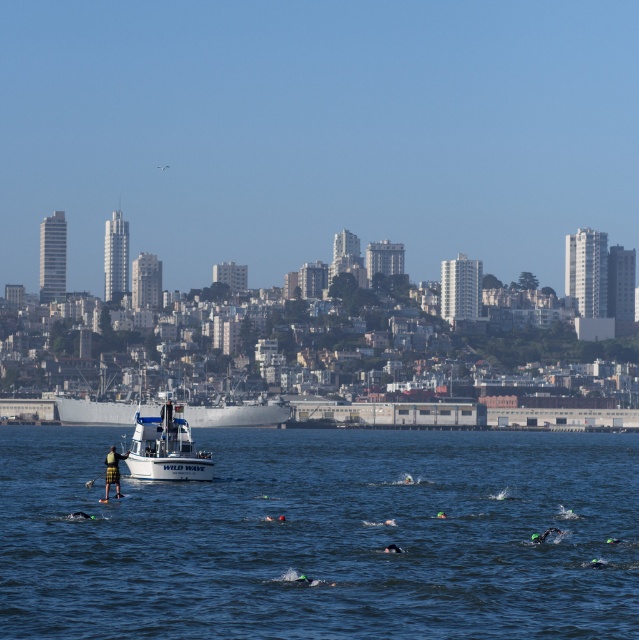
Question: Can you confirm if green kilt at center is bigger than green matte swim cap at lower center?

Choices:
 (A) no
 (B) yes

Answer: (B)

Question: Which point is closer to the camera?

Choices:
 (A) blue water at center
 (B) green matte swim cap at lower center
 (C) white matte boat at center
 (D) green kilt at center

Answer: (A)

Question: Among these objects, which one is nearest to the camera?

Choices:
 (A) blue water at center
 (B) white matte boat at center
 (C) green kilt at center
 (D) green matte swim cap at lower center

Answer: (A)

Question: Can you confirm if blue water at center is wider than white matte boat at center?

Choices:
 (A) no
 (B) yes

Answer: (B)

Question: Considering the real-world distances, which object is farthest from the white matte boat at center?

Choices:
 (A) blue water at center
 (B) green kilt at center
 (C) green matte swim cap at lower center

Answer: (A)

Question: Is green kilt at center wider than green matte swim cap at lower center?

Choices:
 (A) no
 (B) yes

Answer: (B)